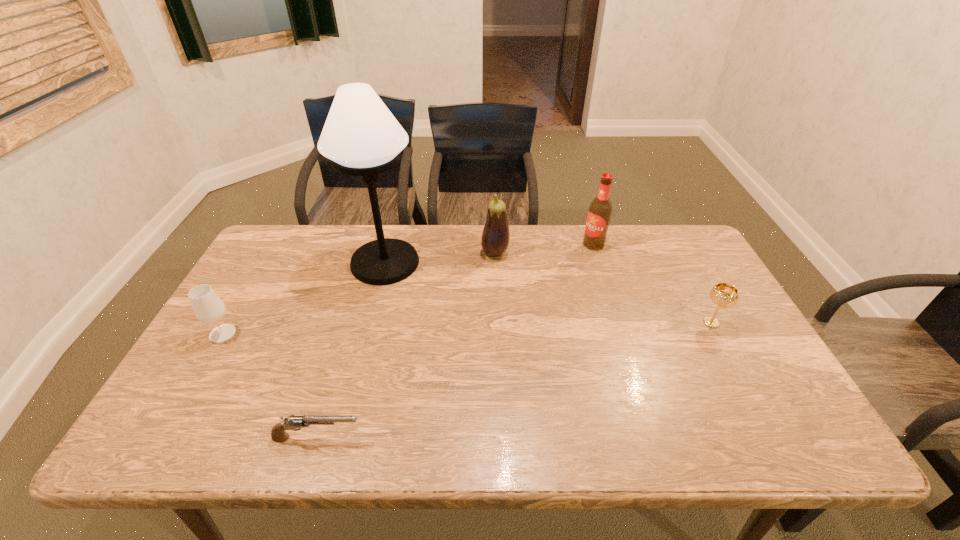
This screenshot has width=960, height=540. Find the location of `object present at the right edge`. object present at the right edge is located at coordinates (725, 295).

Find the location of `free spot at the far edge of the desktop`. free spot at the far edge of the desktop is located at coordinates (432, 244).

You are a GUI agent. You are given a task and a screenshot of the screen. Output one action in this format:
    pyautogui.click(x=<x>, y=<y>)
    Task: Click on the vacant area at the near edge of the desktop
    This screenshot has height=540, width=960.
    Given the screenshot: What is the action you would take?
    pyautogui.click(x=553, y=450)

This screenshot has width=960, height=540. In order to click on vacant region at the left edge of the desktop in this screenshot , I will do `click(233, 301)`.

I want to click on vacant space at the far left corner of the desktop, so click(277, 268).

Image resolution: width=960 pixels, height=540 pixels. What are the coordinates of `empty space that is in between the table lamp and the shortest object` in the screenshot? It's located at (351, 350).

At what (x,y) coordinates should I click in order to perform the action: click on vacant area that lies between the gun and the rightmost object. Please return your answer as a coordinate pair (x, y). The width and height of the screenshot is (960, 540). Looking at the image, I should click on (515, 380).

The width and height of the screenshot is (960, 540). In order to click on free space between the chalice and the leftmost object in this screenshot , I will do `click(467, 328)`.

Where is `free space between the third shortest object and the gun`? The width and height of the screenshot is (960, 540). free space between the third shortest object and the gun is located at coordinates (270, 386).

The image size is (960, 540). Find the location of `empty location between the chalice and the nearest object`. empty location between the chalice and the nearest object is located at coordinates (515, 380).